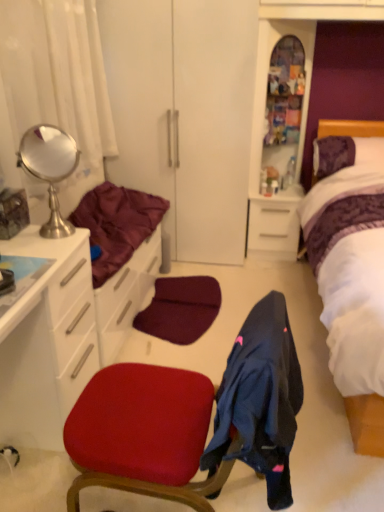
At what (x,y) coordinates should I click in order to perform the action: click on vacant area on top of white glossy drawer at center (from a real-world perspective). Please return your answer as a coordinate pair (x, y). Looking at the image, I should click on (279, 191).